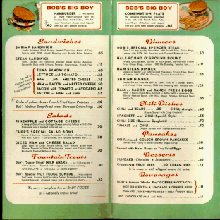
Identify the location of plate. (212, 15).